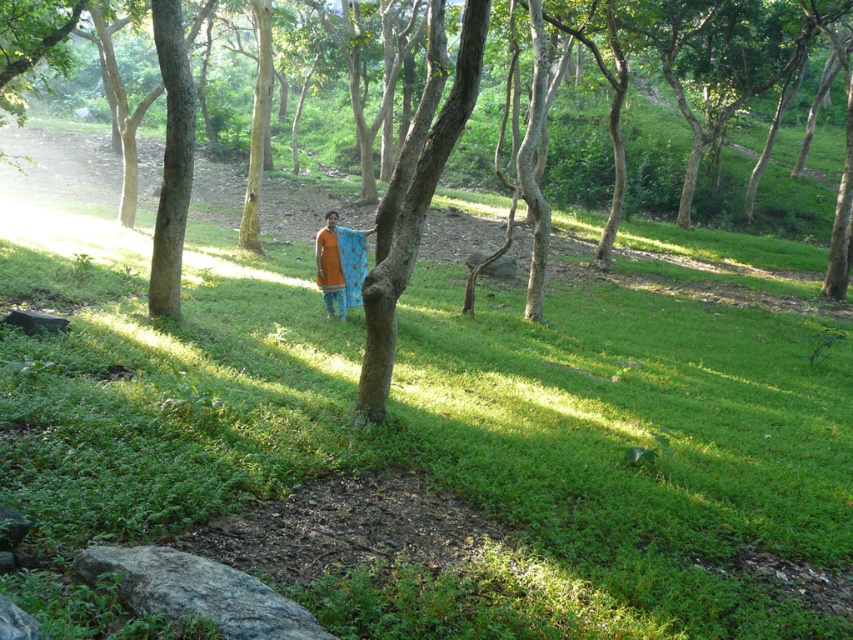
Between rough bark tree at center and orange fabric at center, which one appears on the right side from the viewer's perspective?

From the viewer's perspective, rough bark tree at center appears more on the right side.

Is rough bark tree at center below orange fabric at center?

Indeed, rough bark tree at center is positioned under orange fabric at center.

Measure the distance between rough bark tree at center and camera.

rough bark tree at center and camera are 26.64 feet apart from each other.

Where is `rough bark tree at center`? The width and height of the screenshot is (853, 640). rough bark tree at center is located at coordinates (416, 218).

Consider the image. Who is shorter, green grassy at center or rough bark tree at center?

rough bark tree at center

From the picture: Is green grassy at center below rough bark tree at center?

Yes, green grassy at center is below rough bark tree at center.

Does point (77, 227) come closer to viewer compared to point (416, 166)?

No, (77, 227) is further to viewer.

At what (x,y) coordinates should I click in order to perform the action: click on green grassy at center. Please return your answer as a coordinate pair (x, y). The width and height of the screenshot is (853, 640). Looking at the image, I should click on (439, 435).

Describe the element at coordinates (439, 435) in the screenshot. I see `green grassy at center` at that location.

Between green grassy at center and orange fabric at center, which one appears on the left side from the viewer's perspective?

From the viewer's perspective, green grassy at center appears more on the left side.

Is point (845, 410) farther from viewer compared to point (331, 252)?

No, (845, 410) is closer to viewer.

Locate an element on the screen. The width and height of the screenshot is (853, 640). green grassy at center is located at coordinates (439, 435).